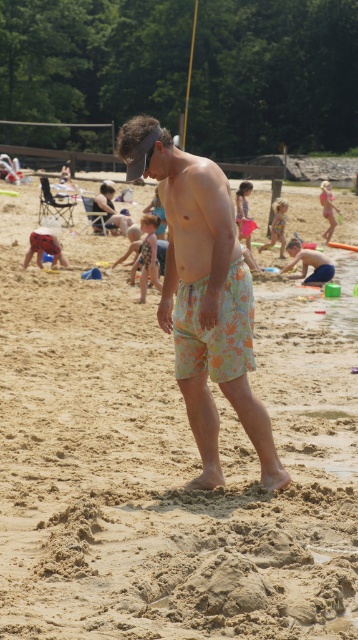
Question: Can you confirm if beige sandy beach at center is positioned above floral swim trunks at center?

Choices:
 (A) yes
 (B) no

Answer: (B)

Question: Does beige sandy beach at center have a smaller size compared to floral swim trunks at center?

Choices:
 (A) yes
 (B) no

Answer: (B)

Question: Can you confirm if beige sandy beach at center is smaller than floral swim trunks at center?

Choices:
 (A) yes
 (B) no

Answer: (B)

Question: Among these objects, which one is nearest to the camera?

Choices:
 (A) floral swim trunks at center
 (B) beige sandy beach at center

Answer: (B)

Question: Which point appears closest to the camera in this image?

Choices:
 (A) (185, 332)
 (B) (66, 348)

Answer: (A)